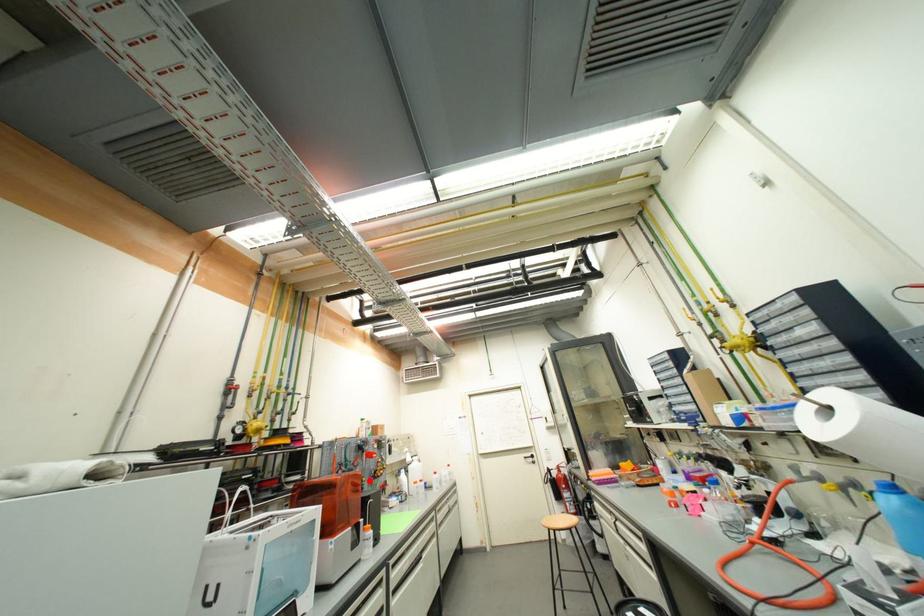
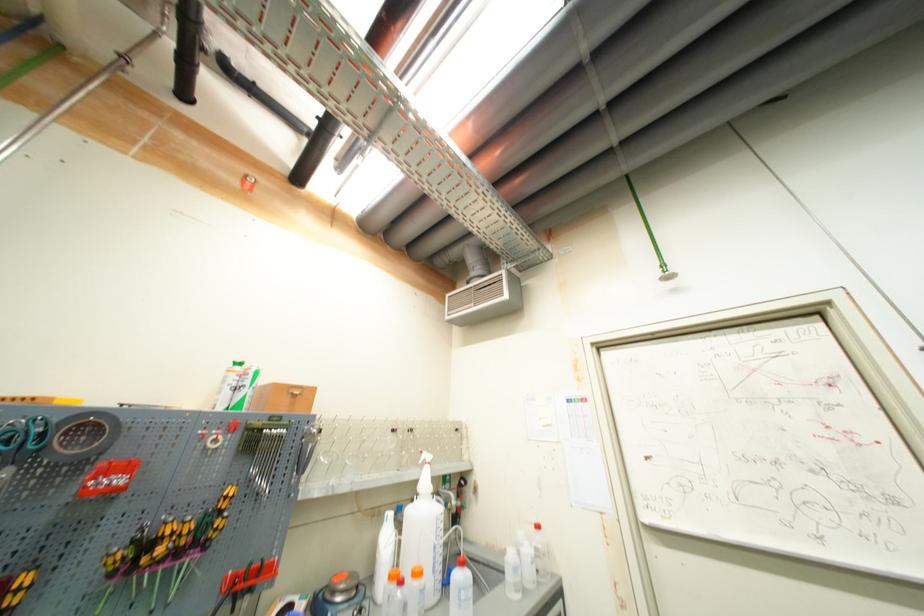
Question: I am providing you with two images of the same scene from different viewpoints. Given a red point in image1, look at the same physical point in image2. Is it:

Choices:
 (A) Closer to the viewpoint
 (B) Farther from the viewpoint

Answer: (A)